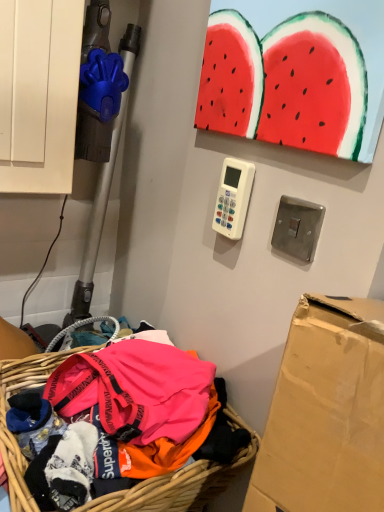
Question: Considering the positions of white plastic remote control at center and bright pink fabric at lower left in the image, is white plastic remote control at center bigger or smaller than bright pink fabric at lower left?

Choices:
 (A) big
 (B) small

Answer: (B)

Question: In terms of width, does white plastic remote control at center look wider or thinner when compared to bright pink fabric at lower left?

Choices:
 (A) thin
 (B) wide

Answer: (A)

Question: Estimate the real-world distances between objects in this image. Which object is closer to the white plastic remote control at center?

Choices:
 (A) brushed metal light switch at upper right
 (B) bright pink fabric at lower left

Answer: (B)

Question: Which object is positioned farthest from the brushed metal light switch at upper right?

Choices:
 (A) bright pink fabric at lower left
 (B) white plastic remote control at center

Answer: (A)